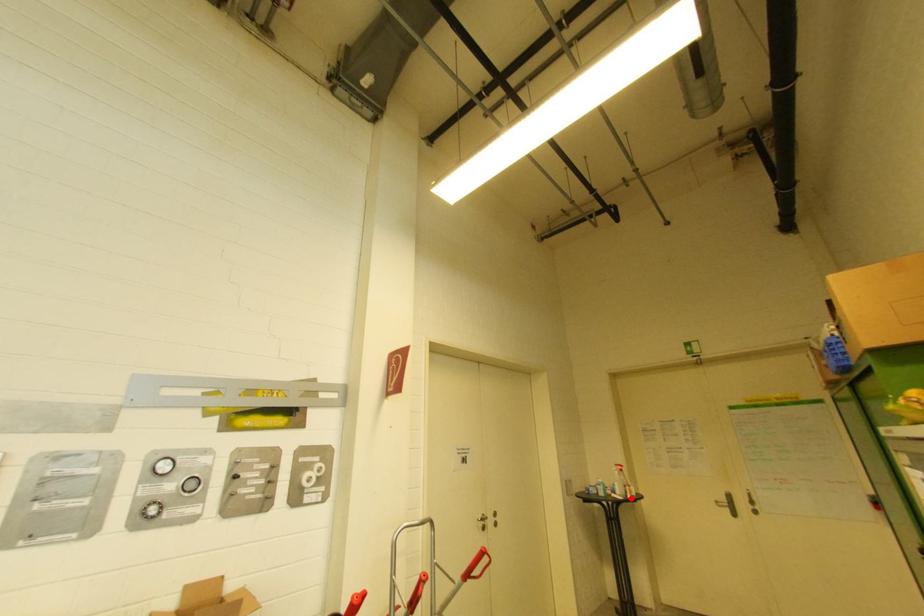
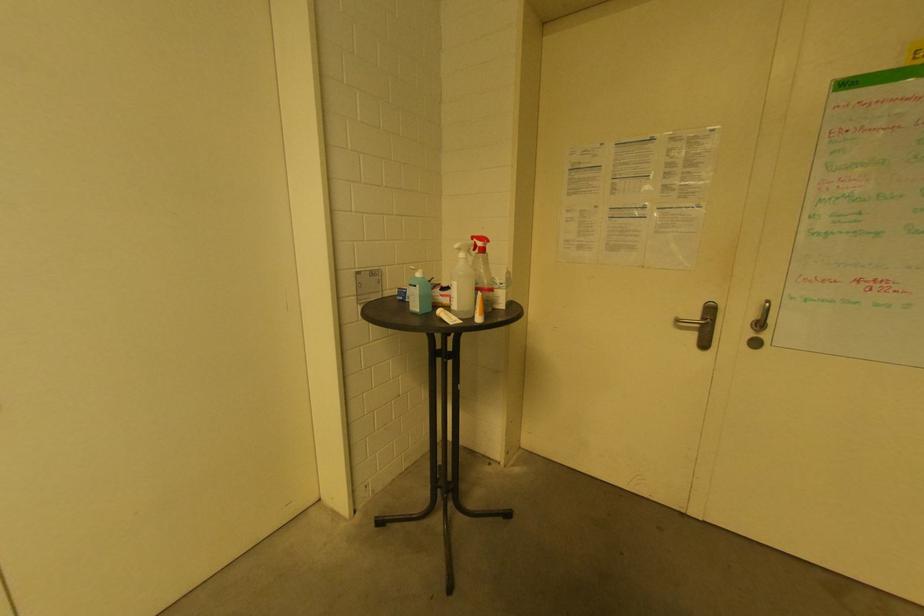
Find the pixel in the second image that matches the highlighted location in the first image.

(480, 321)